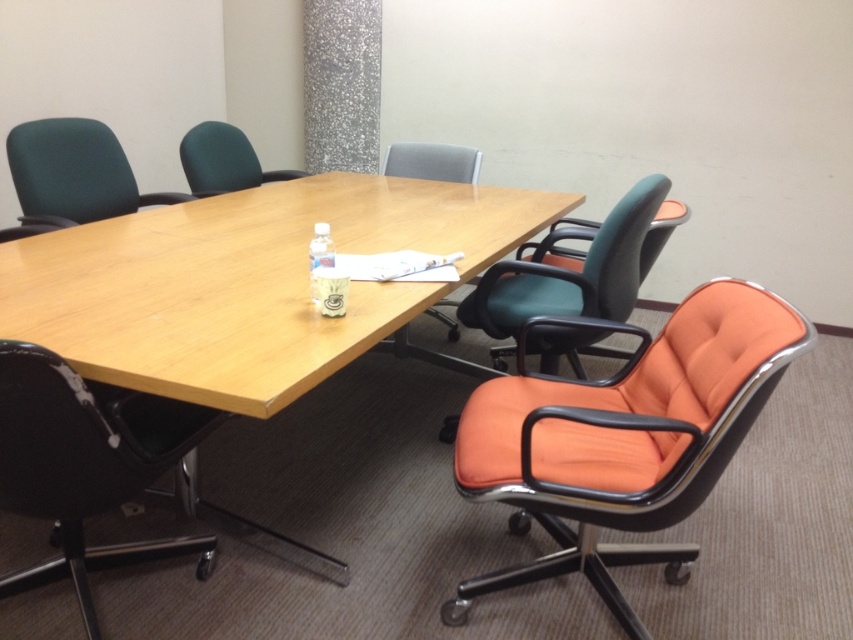
Question: Is orange fabric swivel chair at right below orange fabric chair at right?

Choices:
 (A) yes
 (B) no

Answer: (A)

Question: Can you confirm if orange fabric chair at center is positioned to the left of clear plastic bottle at center?

Choices:
 (A) no
 (B) yes

Answer: (A)

Question: Which of the following is the farthest from the observer?

Choices:
 (A) (96, 140)
 (B) (219, 163)
 (C) (310, 256)
 (D) (38, 449)

Answer: (B)

Question: Which is farther from the orange fabric chair at center?

Choices:
 (A) orange fabric chair at right
 (B) orange fabric swivel chair at right
 (C) clear plastic bottle at center
 (D) wooden table at center

Answer: (B)

Question: Is black leather swivel chair at lower left above orange fabric chair at right?

Choices:
 (A) no
 (B) yes

Answer: (A)

Question: Which point is farther from the camera taking this photo?

Choices:
 (A) (178, 150)
 (B) (561, 490)
 (C) (310, 253)
 (D) (456, 248)

Answer: (A)